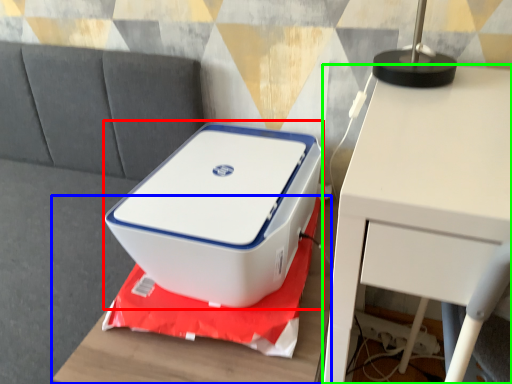
Question: Based on their relative distances, which object is nearer to storage box (highlighted by a red box)? Choose from furniture (highlighted by a blue box) and table (highlighted by a green box).

Choices:
 (A) furniture
 (B) table

Answer: (A)